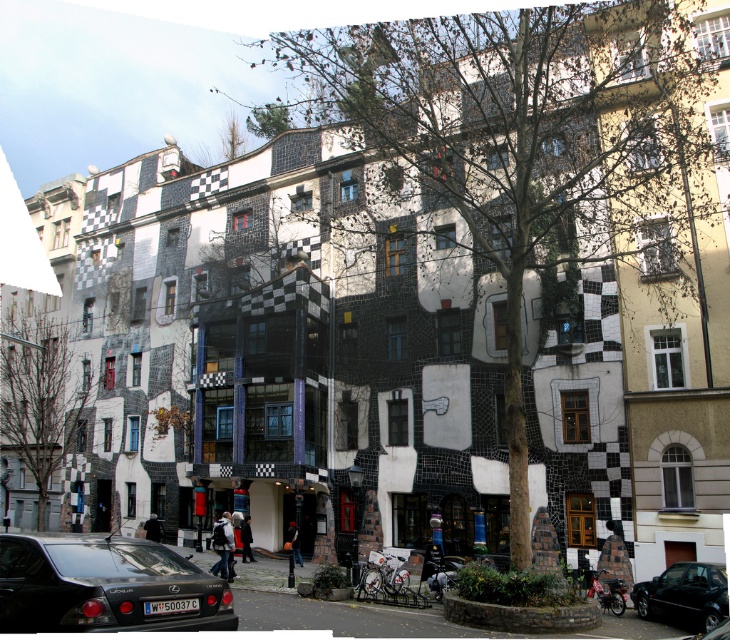
Question: Is white cotton jacket at lower center bigger than dark gray fabric jacket at lower center?

Choices:
 (A) yes
 (B) no

Answer: (A)

Question: Which object is the farthest from the black glossy car at lower left?

Choices:
 (A) white cotton jacket at lower center
 (B) dark gray fabric jacket at lower center
 (C) shiny black car at lower right
 (D) dark blue fabric jacket at center

Answer: (B)

Question: Is white cotton jacket at lower center to the right of dark gray fabric coat at center from the viewer's perspective?

Choices:
 (A) yes
 (B) no

Answer: (B)

Question: Does shiny black car at lower right come in front of dark gray fabric jacket at lower center?

Choices:
 (A) no
 (B) yes

Answer: (B)

Question: Among these objects, which one is farthest from the camera?

Choices:
 (A) dark blue fabric jacket at center
 (B) black glossy car at lower left
 (C) dark gray fabric jacket at lower center
 (D) white cotton jacket at lower center

Answer: (C)

Question: Which point is farther from the camera taking this photo?

Choices:
 (A) [247, 525]
 (B) [723, 570]

Answer: (A)